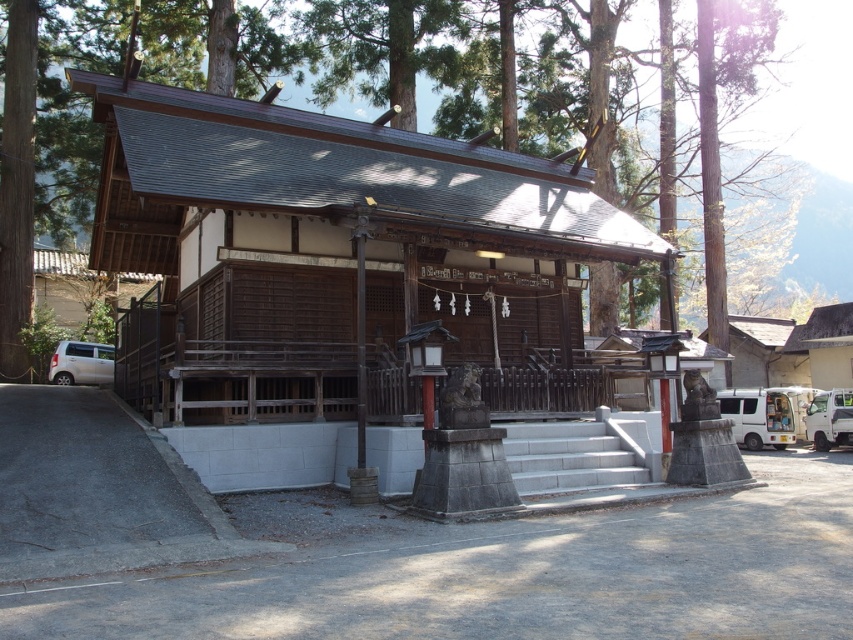
You are a visitor approaching the shrine and see the brown wooden tree at center and the white matte van at right. Which object is closer to the entrance of the shrine?

The brown wooden tree at center is positioned on the left side of the white matte van at right, meaning the van is further away from the entrance. Therefore, the brown wooden tree at center is closer to the entrance.

You are a visitor at the shrine and want to take a photo of the brown wooden tree at center and the silver metallic van at lower left. Which object should you focus on first if you want to capture both in the frame without moving the camera?

You should focus on the brown wooden tree at center first because it is wider than the silver metallic van at lower left, so it requires a wider angle to include both in the frame.